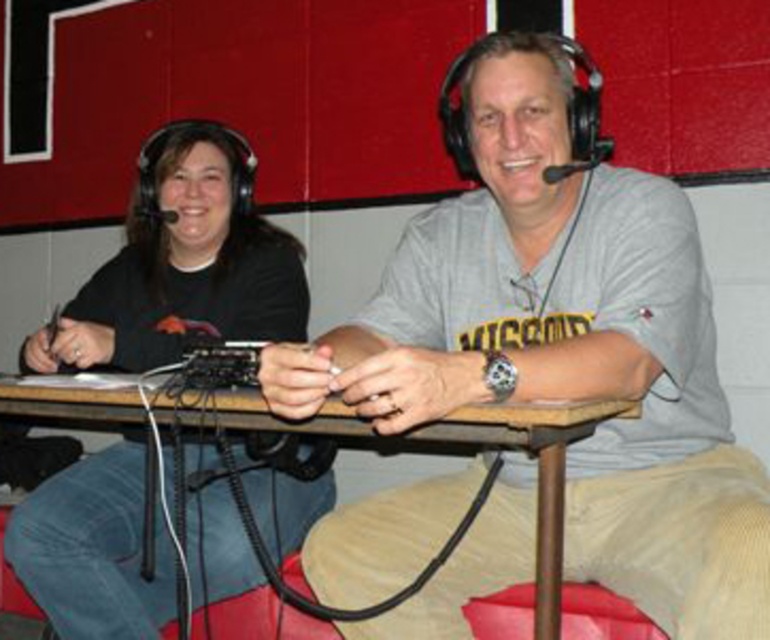
Between black matte headphones at left and wooden table at center, which one appears on the right side from the viewer's perspective?

wooden table at center is more to the right.

The height and width of the screenshot is (640, 770). Describe the element at coordinates (182, 262) in the screenshot. I see `black matte headphones at left` at that location.

Locate an element on the screen. This screenshot has width=770, height=640. black matte headphones at left is located at coordinates (182, 262).